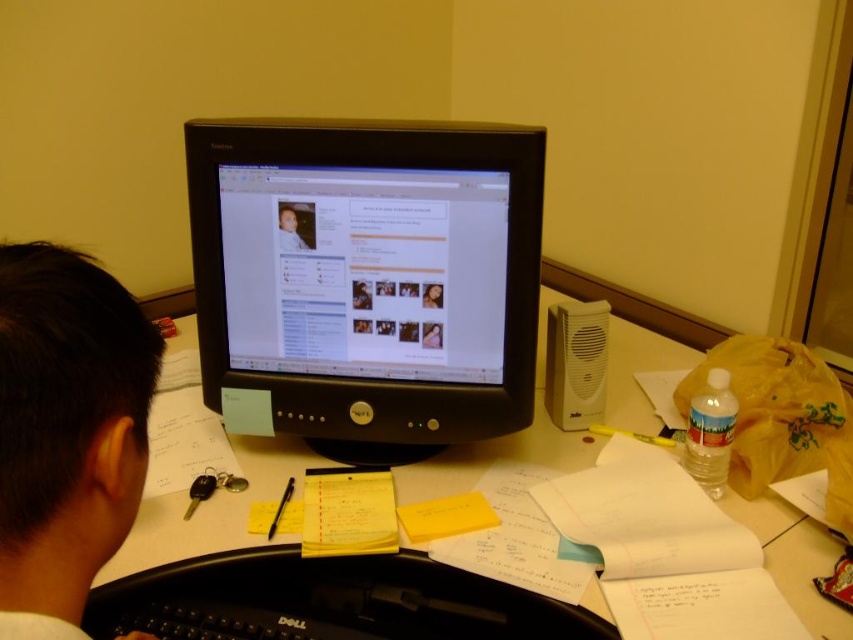
You are a delivery robot with a package that is 12 inches wide. You need to place the package on the desk between the black plastic monitor at center and the white paper at center. Is there enough space between them to fit your package?

The distance between the black plastic monitor at center and the white paper at center is 11.06 inches. Since the package is 12 inches wide, it is slightly wider than the available space. Therefore, the package cannot be placed between them without overlapping.

You are a photographer taking a picture of the workspace setup. You want to ensure that both the black plastic monitor at center and the black hair at upper left are clearly visible in the photo. Which object should you focus on first to ensure depth of field captures both?

The black plastic monitor at center is much taller than the black hair at upper left, so focusing on the closer object, the black hair at upper left, first will help ensure both are in focus.

You are a delivery robot that needs to place a package on the desk without touching the black plastic monitor at center. The package is 0.5 meters wide. Can you safely place it on the desk next to the monitor?

The black plastic monitor at center is 1.04 meters away from the viewer. Since the package is 0.5 meters wide, there should be enough space on the desk next to the monitor to place it without touching the monitor, provided the desk has sufficient clearance. However, the exact placement depends on the desk size and other items present.